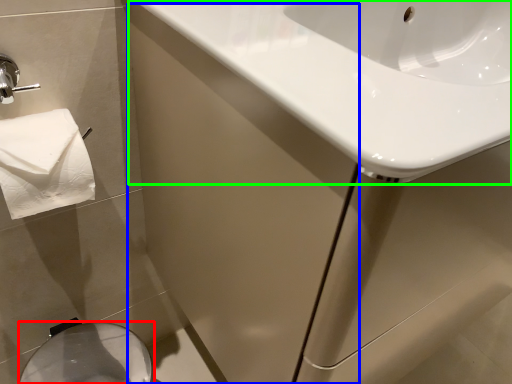
Question: Which object is positioned closest to bidet (highlighted by a red box)? Select from screen door (highlighted by a blue box) and sink (highlighted by a green box).

Choices:
 (A) screen door
 (B) sink

Answer: (A)